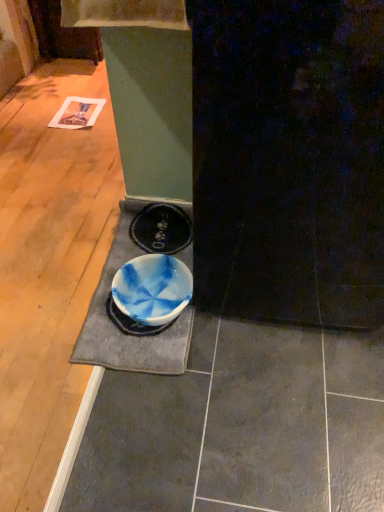
Identify the location of vacant area located to the right-hand side of blue marbled doormat at center. (291, 354).